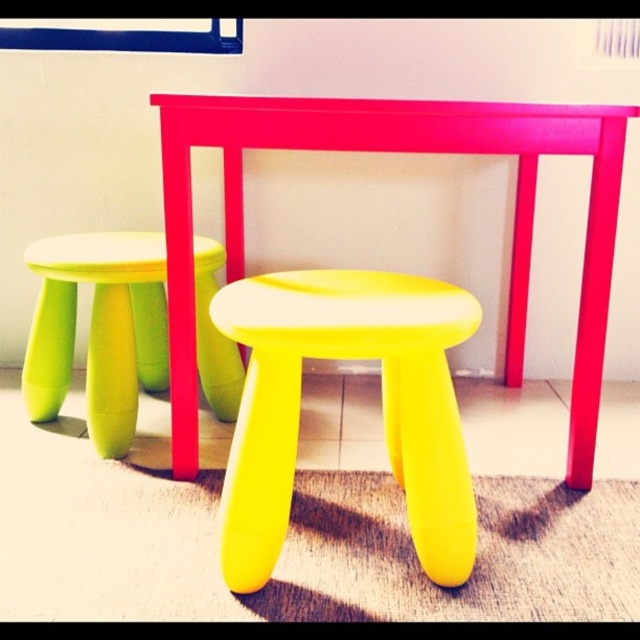
Can you confirm if yellow matte stool at center is shorter than matte pink table at center?

Yes, yellow matte stool at center is shorter than matte pink table at center.

Which is more to the right, yellow matte stool at center or matte pink table at center?

From the viewer's perspective, matte pink table at center appears more on the right side.

At what (x,y) coordinates should I click in order to perform the action: click on yellow matte stool at center. Please return your answer as a coordinate pair (x, y). This screenshot has height=640, width=640. Looking at the image, I should click on (381, 403).

Is matte pink table at center closer to camera compared to yellow matte stool at lower left?

Yes, it is in front of yellow matte stool at lower left.

Who is more forward, (602, 208) or (49, 241)?

Point (602, 208) is more forward.

You are a GUI agent. You are given a task and a screenshot of the screen. Output one action in this format:
    pyautogui.click(x=<x>, y=<y>)
    Task: Click on the matte pink table at center
    
    Given the screenshot: What is the action you would take?
    pyautogui.click(x=397, y=150)

Between yellow matte stool at center and yellow matte stool at lower left, which one has less height?

yellow matte stool at lower left is shorter.

Based on the photo, can you confirm if yellow matte stool at center is positioned to the right of yellow matte stool at lower left?

Correct, you'll find yellow matte stool at center to the right of yellow matte stool at lower left.

Between point (406, 492) and point (116, 396), which one is positioned behind?

Positioned behind is point (116, 396).

Find the location of a particular element. yellow matte stool at center is located at coordinates (381, 403).